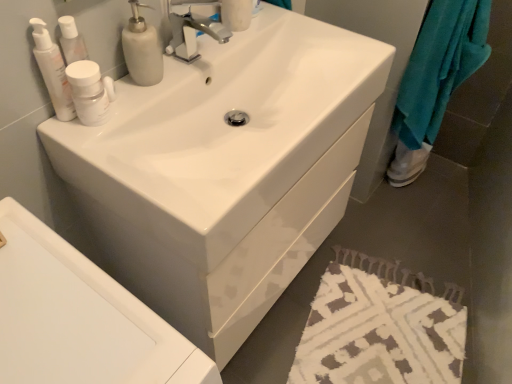
The image size is (512, 384). Describe the element at coordinates (440, 66) in the screenshot. I see `teal plush towel at right` at that location.

What do you see at coordinates (380, 327) in the screenshot?
I see `white textured bath mat at lower right` at bounding box center [380, 327].

The image size is (512, 384). Describe the element at coordinates (142, 49) in the screenshot. I see `white matte soap dispenser at upper left` at that location.

Find the location of a particular element. This screenshot has width=512, height=384. teal plush towel at right is located at coordinates (440, 66).

Which of these two, white glossy bottle at upper left, the second mouthwash viewed from the right, or white matte bottle at upper left, which is the 2th mouthwash from left to right, is smaller?

white glossy bottle at upper left, the second mouthwash viewed from the right, is smaller.

Locate an element on the screen. This screenshot has width=512, height=384. mouthwash above the white matte bottle at upper left, which is the 2th mouthwash from left to right (from a real-world perspective) is located at coordinates coord(52,70).

Is white matte bottle at upper left, which is the 2th mouthwash from left to right, completely or partially inside white glossy bottle at upper left, which is the first mouthwash from left to right?

Actually, white matte bottle at upper left, which is the 2th mouthwash from left to right, is outside white glossy bottle at upper left, which is the first mouthwash from left to right.

From the image's perspective, would you say white glossy bottle at upper left, which is the first mouthwash from left to right, is positioned over white matte bottle at upper left, which appears as the 1th mouthwash when viewed from the right?

Yes, from the image's perspective, white glossy bottle at upper left, which is the first mouthwash from left to right, is above white matte bottle at upper left, which appears as the 1th mouthwash when viewed from the right.

Is white textured bath mat at lower right completely or partially inside white glossy sink at center?

No, white glossy sink at center does not contain white textured bath mat at lower right.

Does white glossy sink at center have a greater height compared to white textured bath mat at lower right?

Yes, white glossy sink at center is taller than white textured bath mat at lower right.

In the image, is white glossy sink at center on the left side or the right side of white textured bath mat at lower right?

white glossy sink at center is to the left of white textured bath mat at lower right.

Is the depth of white glossy sink at center less than that of white textured bath mat at lower right?

Yes, white glossy sink at center is closer to the viewer.

Is white glossy sink at center to the left or to the right of white matte soap dispenser at upper left in the image?

white glossy sink at center is positioned on white matte soap dispenser at upper left's left side.

Considering the relative sizes of white glossy sink at center and white matte soap dispenser at upper left in the image provided, is white glossy sink at center taller than white matte soap dispenser at upper left?

Indeed, white glossy sink at center has a greater height compared to white matte soap dispenser at upper left.

Considering the sizes of objects white glossy sink at center and white matte soap dispenser at upper left in the image provided, who is thinner, white glossy sink at center or white matte soap dispenser at upper left?

Thinner between the two is white matte soap dispenser at upper left.

Is white glossy sink at center not inside white matte soap dispenser at upper left?

Yes, white glossy sink at center is not within white matte soap dispenser at upper left.

Is point (185, 188) behind point (388, 372)?

No, (185, 188) is in front of (388, 372).

Does white glossy sink at center appear on the left side of white textured bath mat at lower right?

Correct, you'll find white glossy sink at center to the left of white textured bath mat at lower right.

Is white glossy sink at center shorter than white textured bath mat at lower right?

No, white glossy sink at center is not shorter than white textured bath mat at lower right.

Which is behind, white glossy sink at center or white textured bath mat at lower right?

Positioned behind is white textured bath mat at lower right.

Does white glossy sink at center lie behind white glossy sink at center?

No, it is in front of white glossy sink at center.

From a real-world perspective, which object rests below the other?

white glossy sink at center, from a real-world perspective.

Is point (155, 336) farther from camera compared to point (226, 176)?

No.

Considering the sizes of objects white matte soap dispenser at upper left and white matte bottle at upper left, which appears as the 1th mouthwash when viewed from the right, in the image provided, who is wider, white matte soap dispenser at upper left or white matte bottle at upper left, which appears as the 1th mouthwash when viewed from the right,?

With larger width is white matte soap dispenser at upper left.

Identify the location of soap dispenser behind the white matte bottle at upper left, which is the 2th mouthwash from left to right. This screenshot has height=384, width=512. (142, 49).

Could you tell me if white matte soap dispenser at upper left is facing white matte bottle at upper left, which appears as the 1th mouthwash when viewed from the right?

No, white matte soap dispenser at upper left is not turned towards white matte bottle at upper left, which appears as the 1th mouthwash when viewed from the right.

Is point (157, 75) less distant than point (94, 67)?

No, (157, 75) is further to viewer.

Between white glossy sink at center and white matte bottle at upper left, which appears as the 1th mouthwash when viewed from the right, which one is positioned in front?

Positioned in front is white glossy sink at center.

Which of these two, white glossy sink at center or white matte bottle at upper left, which is the 2th mouthwash from left to right, is bigger?

white glossy sink at center is bigger.

Where is `mouthwash that is the 1st object located above the white glossy sink at center (from the image's perspective)`? The image size is (512, 384). mouthwash that is the 1st object located above the white glossy sink at center (from the image's perspective) is located at coordinates (90, 92).

From a real-world perspective, which is physically below, white glossy sink at center or white matte bottle at upper left, which is the 2th mouthwash from left to right?

white glossy sink at center.

Identify the location of mouthwash in front of the white matte bottle at upper left, which is the 2th mouthwash from left to right. (52, 70).

At what (x,y) coordinates should I click in order to perform the action: click on bath that is above the white textured bath mat at lower right (from a real-world perspective). Please return your answer as a coordinate pair (x, y). Looking at the image, I should click on (79, 318).

When comparing their distances from white textured bath mat at lower right, does teal plush towel at right or white glossy sink at center seem further?

The object further to white textured bath mat at lower right is white glossy sink at center.

From the picture: Based on their spatial positions, is white matte soap dispenser at upper left or white glossy sink at center closer to white glossy sink at center?

white glossy sink at center.

Estimate the real-world distances between objects in this image. Which object is further from white glossy sink at center, teal plush towel at right or white glossy bottle at upper left, the second mouthwash viewed from the right?

teal plush towel at right is further to white glossy sink at center.

Consider the image. Based on their spatial positions, is white glossy sink at center or white glossy sink at center further from white glossy bottle at upper left, which is the first mouthwash from left to right?

Among the two, white glossy sink at center is located further to white glossy bottle at upper left, which is the first mouthwash from left to right.

Looking at the image, which one is located closer to white glossy sink at center, teal plush towel at right or white glossy bottle at upper left, which is the first mouthwash from left to right?

Among the two, white glossy bottle at upper left, which is the first mouthwash from left to right, is located nearer to white glossy sink at center.

Looking at the image, which one is located closer to white glossy sink at center, white glossy bottle at upper left, which is the first mouthwash from left to right, or white glossy sink at center?

white glossy sink at center is closer to white glossy sink at center.

When comparing their distances from white glossy sink at center, does white glossy bottle at upper left, the second mouthwash viewed from the right, or white matte bottle at upper left, which appears as the 1th mouthwash when viewed from the right, seem closer?

white matte bottle at upper left, which appears as the 1th mouthwash when viewed from the right.

Based on their spatial positions, is white glossy bottle at upper left, which is the first mouthwash from left to right, or white matte bottle at upper left, which appears as the 1th mouthwash when viewed from the right, further from white textured bath mat at lower right?

white glossy bottle at upper left, which is the first mouthwash from left to right, is further to white textured bath mat at lower right.

Locate an element on the screen. soap dispenser between white matte bottle at upper left, which appears as the 1th mouthwash when viewed from the right, and white glossy sink at center is located at coordinates (142, 49).

Where is `soap dispenser located between white matte bottle at upper left, which is the 2th mouthwash from left to right, and teal plush towel at right in the left-right direction`? soap dispenser located between white matte bottle at upper left, which is the 2th mouthwash from left to right, and teal plush towel at right in the left-right direction is located at coordinates (142, 49).

Find the location of a particular element. This screenshot has width=512, height=384. sink situated between white glossy bottle at upper left, the second mouthwash viewed from the right, and white textured bath mat at lower right from left to right is located at coordinates (223, 131).

At what (x,y) coordinates should I click in order to perform the action: click on sink between white glossy bottle at upper left, the second mouthwash viewed from the right, and teal plush towel at right from left to right. Please return your answer as a coordinate pair (x, y). The width and height of the screenshot is (512, 384). Looking at the image, I should click on (223, 131).